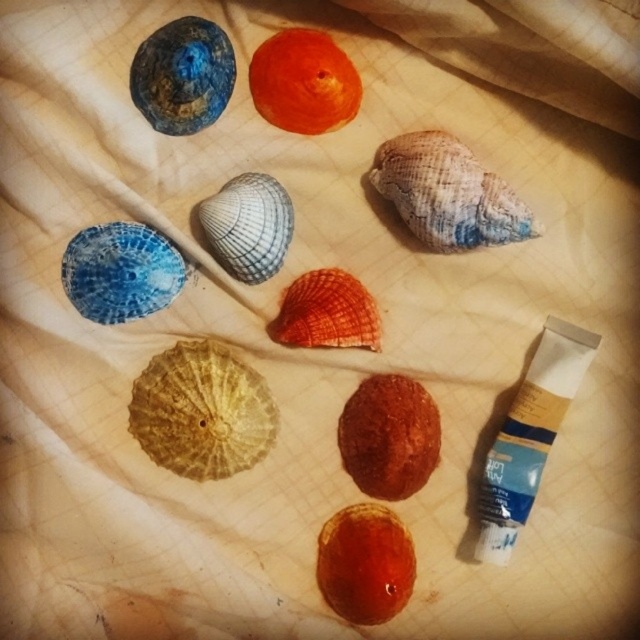
Question: Is glossy orange shell at center below orange matte shell at upper center?

Choices:
 (A) no
 (B) yes

Answer: (B)

Question: Is glossy orange shell at center wider than orange matte shell at upper center?

Choices:
 (A) yes
 (B) no

Answer: (B)

Question: Which point is farther from the camera taking this photo?

Choices:
 (A) (307, 49)
 (B) (364, 611)

Answer: (B)

Question: Is glossy orange shell at center bigger than orange matte shell at upper center?

Choices:
 (A) yes
 (B) no

Answer: (A)